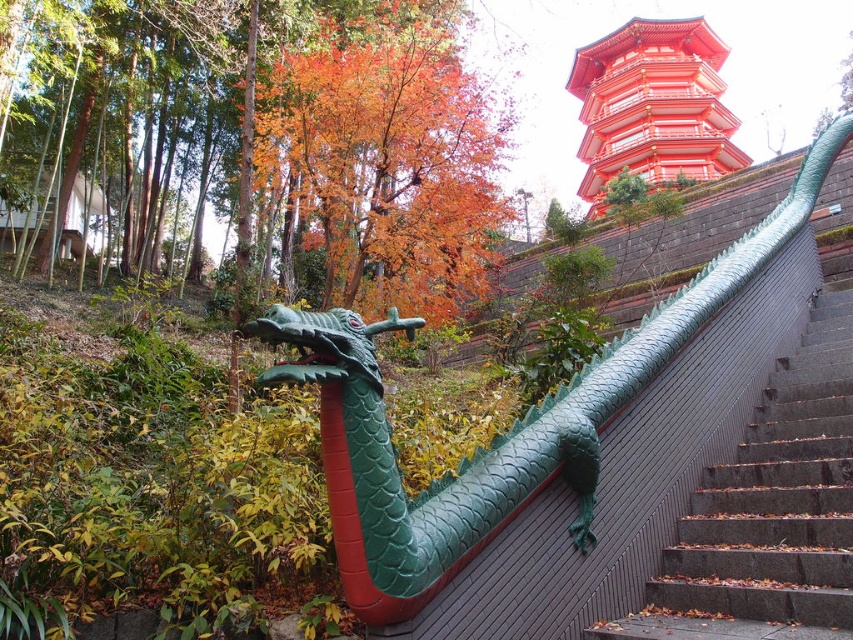
You are a visitor at this autumnal site and want to take a photo of both the green matte dragon at center and the shiny lacquered pagoda at upper right. Since you have a camera with a limited zoom, which object should you move closer to in order to capture both in the same frame?

The green matte dragon at center is shorter than the shiny lacquered pagoda at upper right. To capture both in the same frame, you should move closer to the green matte dragon at center so that it appears larger in the frame, while the pagoda remains visible in the background.